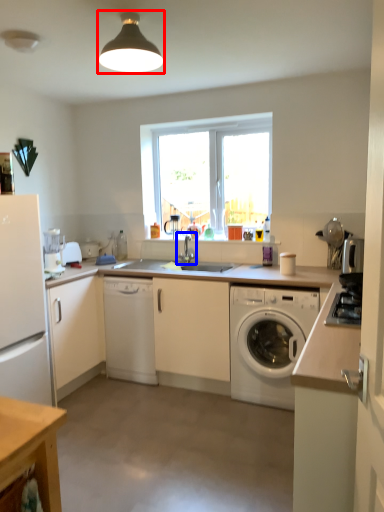
Question: Which object appears closest to the camera in this image, light fixture (highlighted by a red box) or tap (highlighted by a blue box)?

Choices:
 (A) light fixture
 (B) tap

Answer: (A)